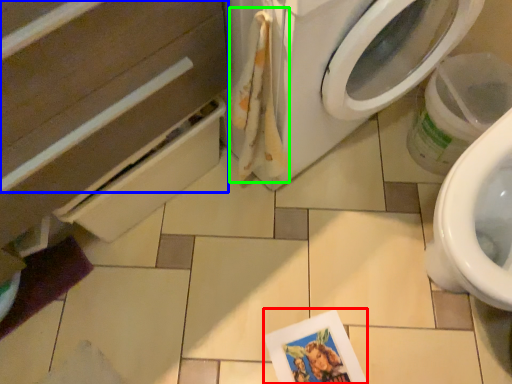
Question: Based on their relative distances, which object is farther from postcard (highlighted by a red box)? Choose from drawer (highlighted by a blue box) and laundry (highlighted by a green box).

Choices:
 (A) drawer
 (B) laundry

Answer: (A)